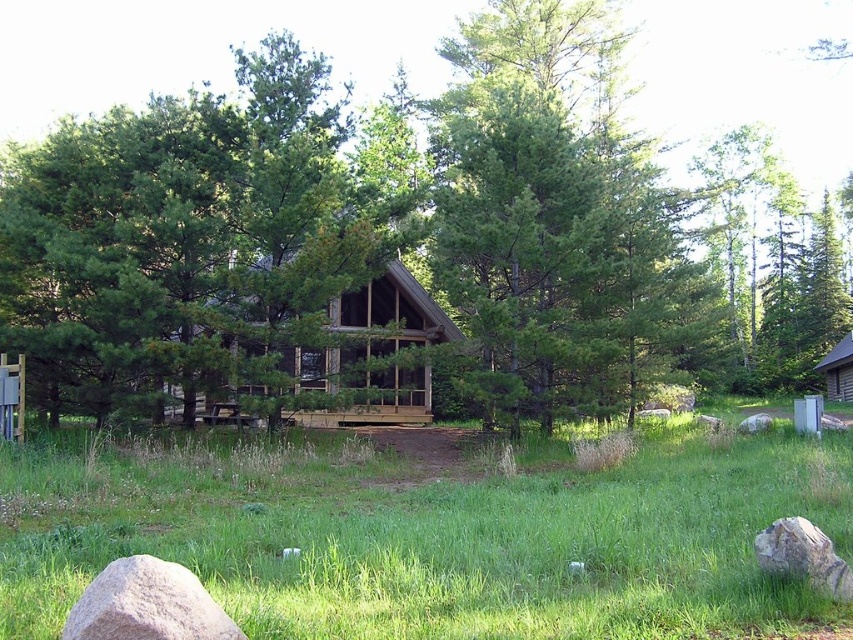
Is green wood tree at center to the right of gray rough rock at lower left from the viewer's perspective?

In fact, green wood tree at center is to the left of gray rough rock at lower left.

This screenshot has height=640, width=853. Identify the location of green wood tree at center. click(x=195, y=45).

At what (x,y) coordinates should I click in order to perform the action: click on green wood tree at center. Please return your answer as a coordinate pair (x, y). This screenshot has width=853, height=640. Looking at the image, I should click on (195, 45).

Where is `green wood tree at center`? Image resolution: width=853 pixels, height=640 pixels. green wood tree at center is located at coordinates (195, 45).

Between green grass at center and wooden cabin at center, which one is positioned lower?

green grass at center is below.

Is green grass at center smaller than wooden cabin at center?

Indeed, green grass at center has a smaller size compared to wooden cabin at center.

Measure the distance between green grass at center and camera.

A distance of 12.22 feet exists between green grass at center and camera.

Image resolution: width=853 pixels, height=640 pixels. I want to click on green grass at center, so click(x=434, y=536).

Does point (345, 8) lie behind point (799, 532)?

That is True.

Does green wood tree at center come in front of gray rough rock at lower right?

That is False.

Image resolution: width=853 pixels, height=640 pixels. What do you see at coordinates (195, 45) in the screenshot?
I see `green wood tree at center` at bounding box center [195, 45].

Find the location of a particular element. green wood tree at center is located at coordinates (195, 45).